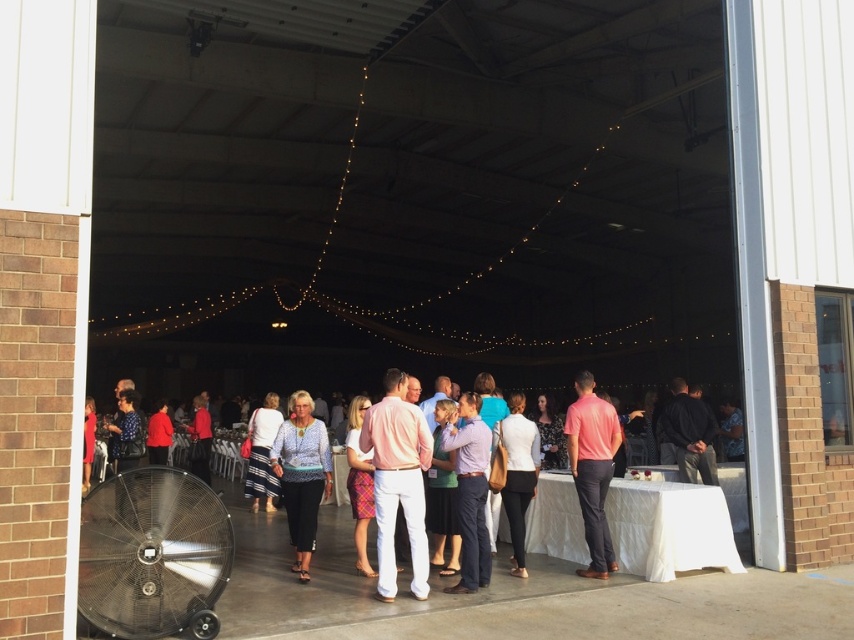
Question: Can you confirm if matte pink shirt at center is smaller than light blue shirt at center?

Choices:
 (A) yes
 (B) no

Answer: (B)

Question: Based on their relative distances, which object is nearer to the white striped dress at center?

Choices:
 (A) pink cotton shirt at center
 (B) matte black dress at center

Answer: (B)

Question: Which of the following is the closest to the observer?

Choices:
 (A) (250, 483)
 (B) (469, 465)
 (C) (733, 513)

Answer: (B)

Question: From the image, what is the correct spatial relationship of white matte blazer at center in relation to white striped dress at center?

Choices:
 (A) right
 (B) left

Answer: (A)

Question: Estimate the real-world distances between objects in this image. Which object is farther from the pink cotton shirt at center?

Choices:
 (A) pink matte shirt at center
 (B) white matte blazer at center
 (C) white cloth-covered table at lower right

Answer: (C)

Question: Does pink cotton shirt at center come in front of matte black dress at center?

Choices:
 (A) yes
 (B) no

Answer: (A)